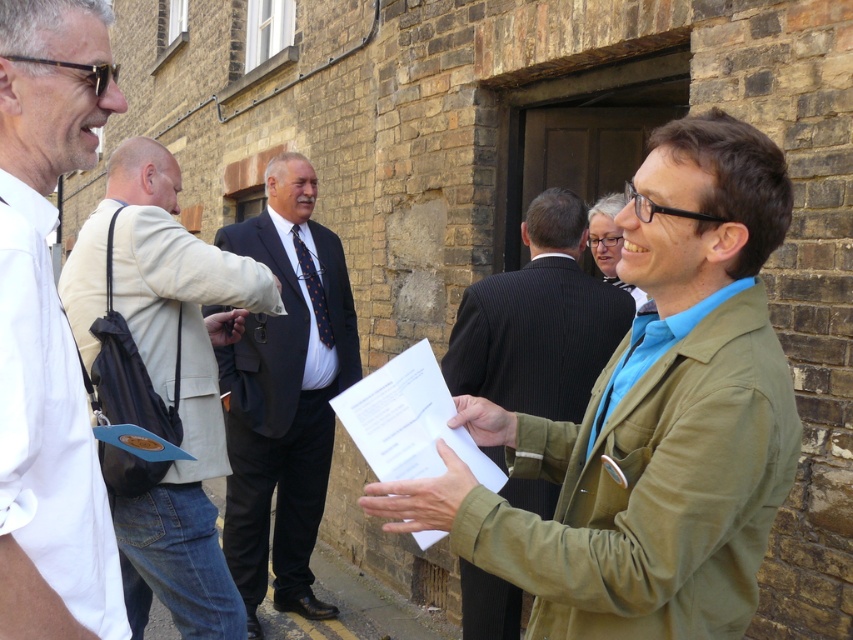
Which is below, light beige jacket at center or green textured jacket at center?

light beige jacket at center

Which is in front, point (131, 177) or point (573, 248)?

Point (131, 177) is more forward.

Image resolution: width=853 pixels, height=640 pixels. What are the coordinates of `light beige jacket at center` in the screenshot? It's located at (167, 380).

The height and width of the screenshot is (640, 853). What do you see at coordinates (648, 419) in the screenshot?
I see `olive-green fabric jacket at center-right` at bounding box center [648, 419].

Is olive-green fabric jacket at center-right positioned at the back of dark blue suit at center?

No, it is not.

Between point (604, 429) and point (306, 426), which one is positioned behind?

The point (306, 426) is more distant.

Identify the location of olive-green fabric jacket at center-right. Image resolution: width=853 pixels, height=640 pixels. (648, 419).

This screenshot has height=640, width=853. Describe the element at coordinates (167, 380) in the screenshot. I see `light beige jacket at center` at that location.

Does point (207, 632) come behind point (248, 486)?

No, (207, 632) is in front of (248, 486).

This screenshot has height=640, width=853. Identify the location of light beige jacket at center. (167, 380).